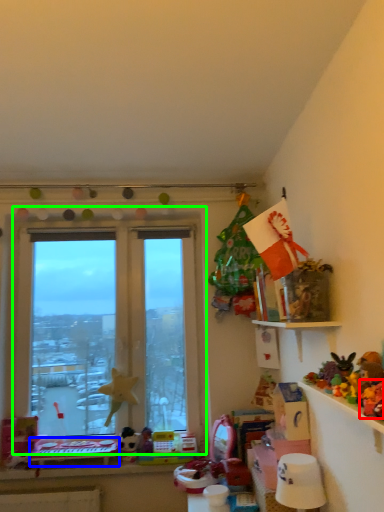
Question: Considering the real-world distances, which object is farthest from toy (highlighted by a red box)? table (highlighted by a blue box) or window (highlighted by a green box)?

Choices:
 (A) table
 (B) window

Answer: (B)